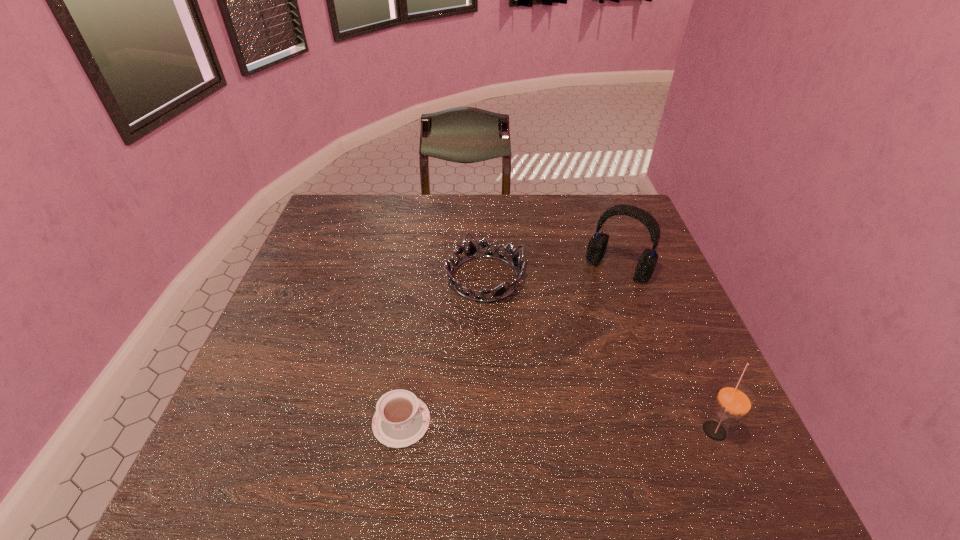
The height and width of the screenshot is (540, 960). In order to click on free spot between the leftmost object and the straw in this screenshot , I will do `click(558, 425)`.

I want to click on unoccupied area between the straw and the teacup, so click(x=558, y=425).

Where is `vacant area that lies between the straw and the second object from left to right`? vacant area that lies between the straw and the second object from left to right is located at coordinates (599, 354).

In order to click on free space between the headset and the straw in this screenshot , I will do `click(666, 349)`.

Find the location of a particular element. free space between the teacup and the straw is located at coordinates (558, 425).

Locate which object is the closest to the headset. Please provide its 2D coordinates. Your answer should be formatted as a tuple, i.e. [(x, y)], where the tuple contains the x and y coordinates of a point satisfying the conditions above.

[(471, 251)]

Identify the location of object identified as the second closest to the headset. (734, 400).

The image size is (960, 540). I want to click on vacant space that satisfies the following two spatial constraints: 1. on the front side of the tiara; 2. on the right side of the straw, so tap(487, 429).

The height and width of the screenshot is (540, 960). Find the location of `free region that satisfies the following two spatial constraints: 1. on the back side of the headset; 2. on the right side of the tiara`. free region that satisfies the following two spatial constraints: 1. on the back side of the headset; 2. on the right side of the tiara is located at coordinates (485, 268).